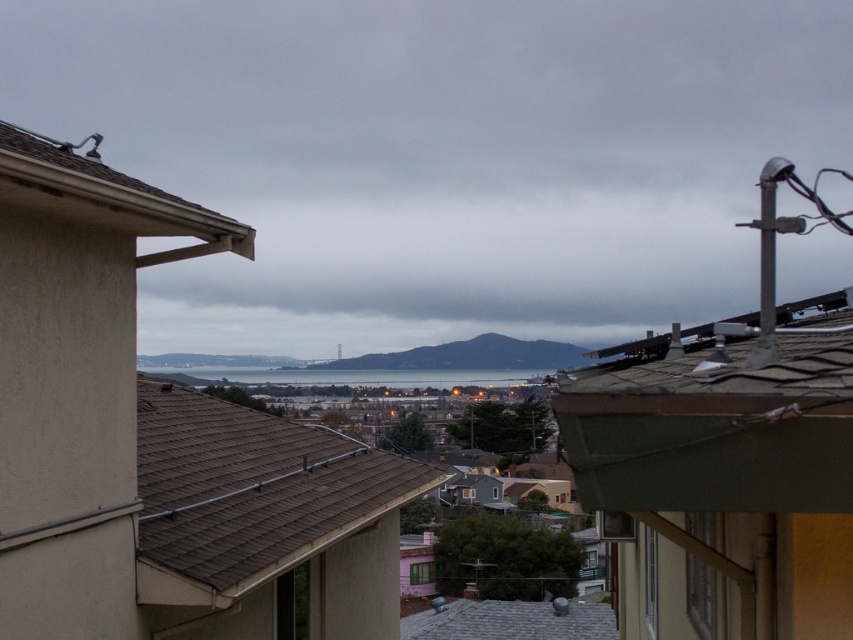
Can you confirm if green shingles at upper right is positioned above gray shingles at center?

Indeed, green shingles at upper right is positioned over gray shingles at center.

The image size is (853, 640). Describe the element at coordinates (712, 429) in the screenshot. I see `green shingles at upper right` at that location.

Identify the location of green shingles at upper right. The width and height of the screenshot is (853, 640). (712, 429).

Which is behind, point (691, 467) or point (57, 152)?

The point (57, 152) is behind.

Between green shingles at upper right and brown shingles at upper left, which one has less height?

Standing shorter between the two is green shingles at upper right.

Is point (664, 508) positioned before point (22, 205)?

Yes, point (664, 508) is closer to viewer.

Find the location of a particular element. green shingles at upper right is located at coordinates (712, 429).

Who is positioned more to the left, brown shingles at center or brown shingles at upper left?

brown shingles at upper left is more to the left.

Can you confirm if brown shingles at center is positioned below brown shingles at upper left?

Correct, brown shingles at center is located below brown shingles at upper left.

Who is more forward, [274,528] or [10,129]?

Positioned in front is point [10,129].

Locate an element on the screen. The height and width of the screenshot is (640, 853). brown shingles at center is located at coordinates (247, 493).